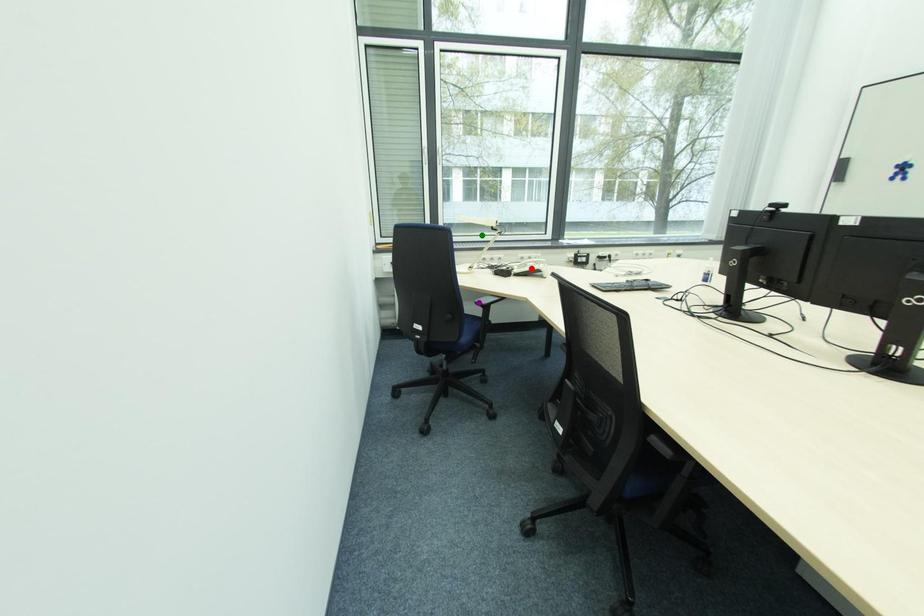
Order these from nearest to farthest:
red point, purple point, green point

purple point → red point → green point